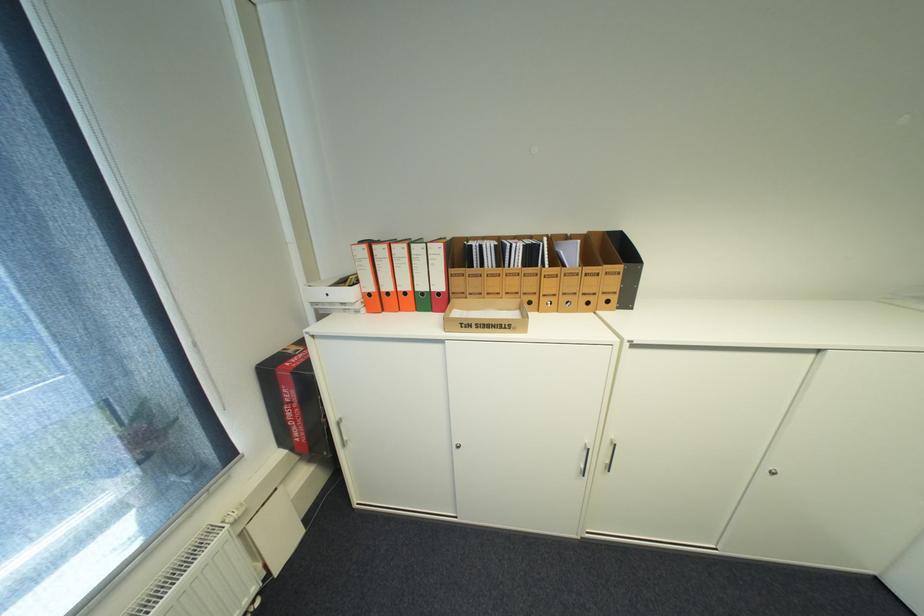
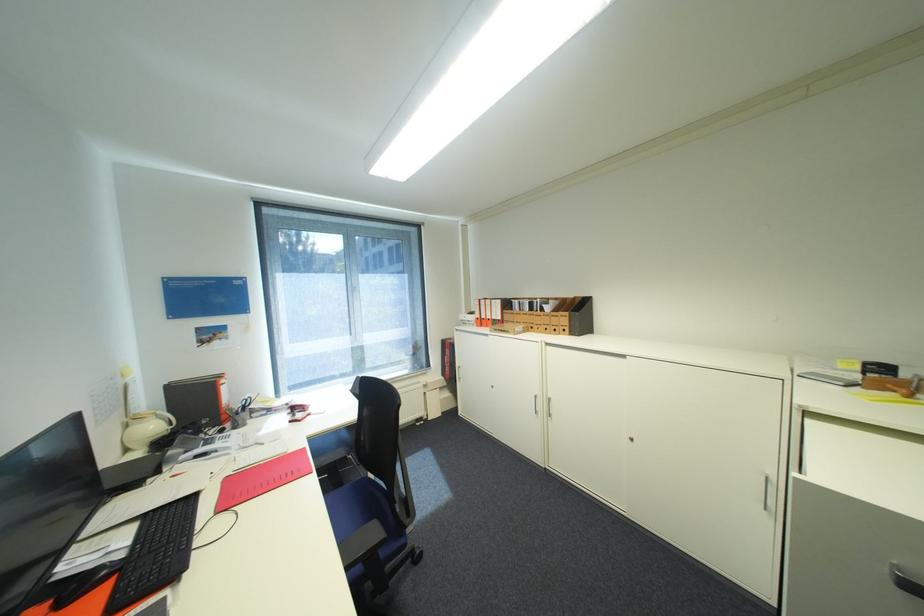
In the second image, find the point that corresponds to (359,294) in the first image.

(480, 318)